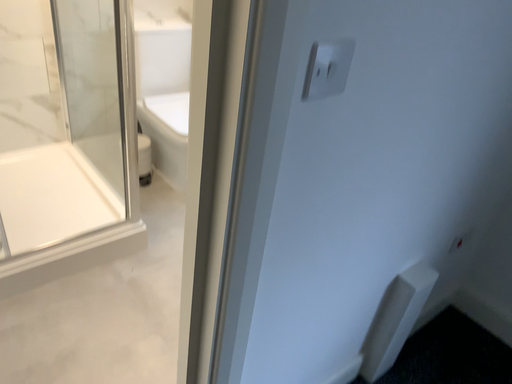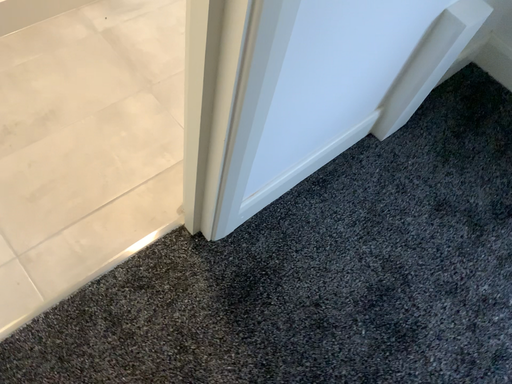
Question: Which way did the camera rotate in the video?

Choices:
 (A) rotated upward
 (B) rotated downward

Answer: (B)